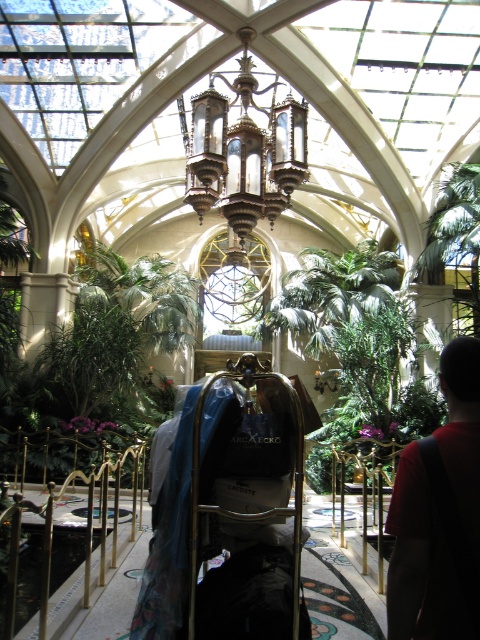
Question: Can you confirm if dark red shirt at lower right is bigger than polished brass chandelier at center?

Choices:
 (A) yes
 (B) no

Answer: (A)

Question: Is metallic gold luggage cart at center wider than polished brass chandelier at center?

Choices:
 (A) yes
 (B) no

Answer: (A)

Question: Estimate the real-world distances between objects in this image. Which object is closer to the dark red shirt at lower right?

Choices:
 (A) polished brass chandelier at center
 (B) metallic gold luggage cart at center

Answer: (B)

Question: Can you confirm if dark red shirt at lower right is positioned to the right of polished brass chandelier at center?

Choices:
 (A) no
 (B) yes

Answer: (B)

Question: Based on their relative distances, which object is farther from the dark red shirt at lower right?

Choices:
 (A) metallic gold luggage cart at center
 (B) polished brass chandelier at center

Answer: (B)

Question: Which point is closer to the camera?

Choices:
 (A) (443, 374)
 (B) (182, 108)

Answer: (A)